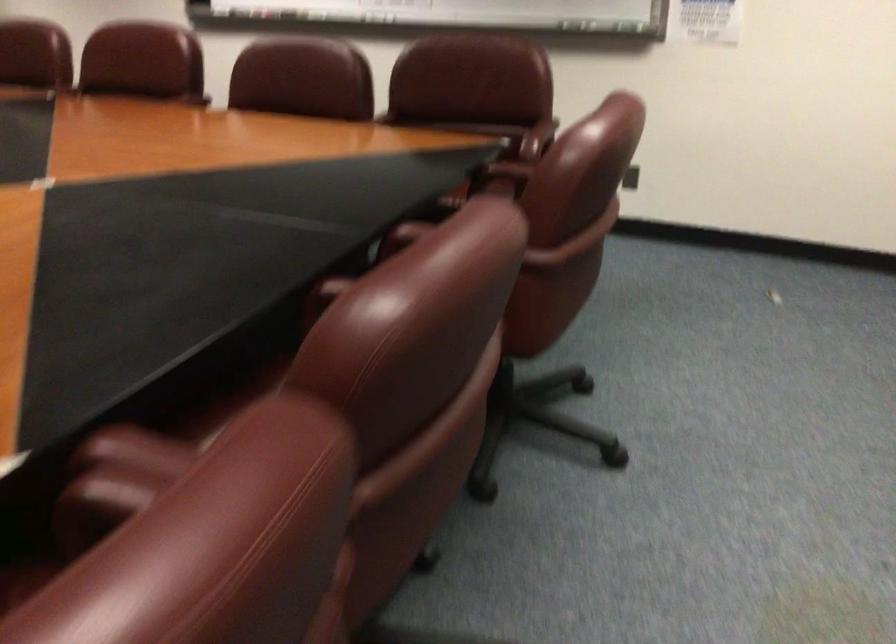
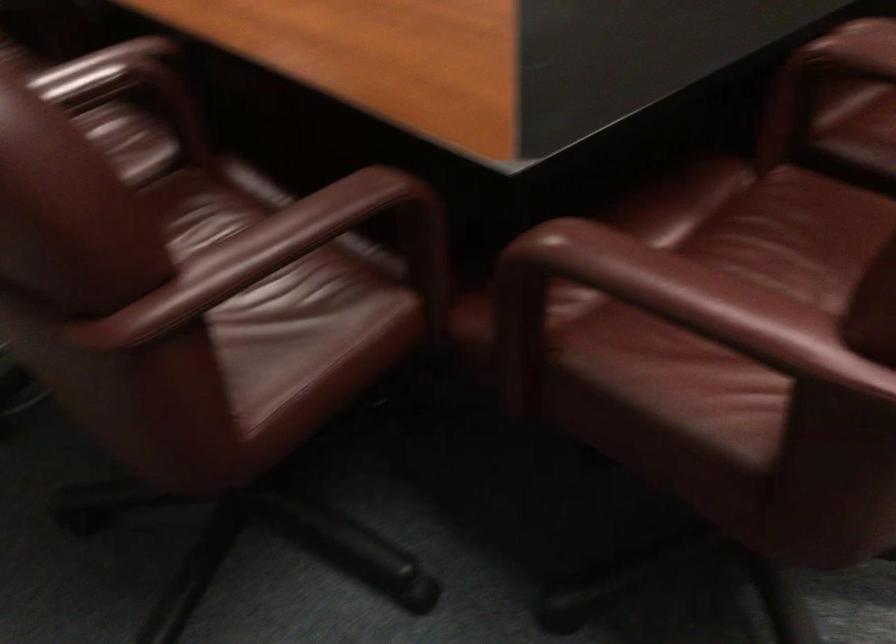
First-person continuous shooting, in which direction is the camera rotating?

The rotation direction of the camera is right-down.